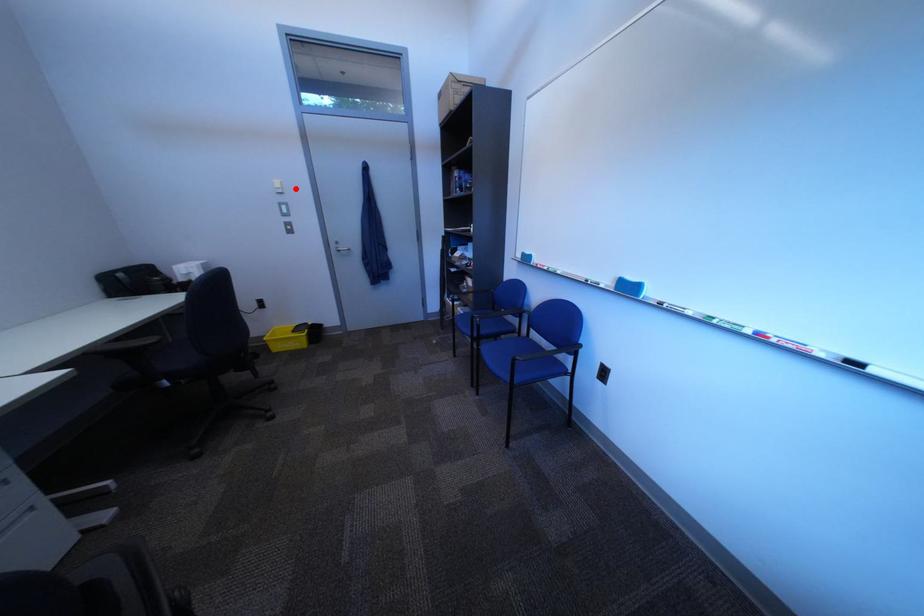
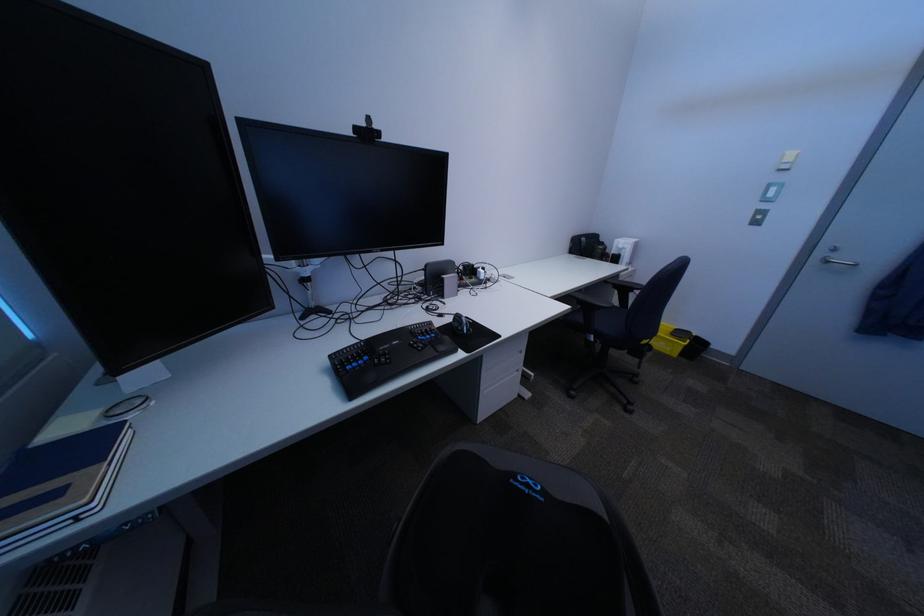
In the second image, find the point that corresponds to the highlighted location in the first image.

(807, 163)